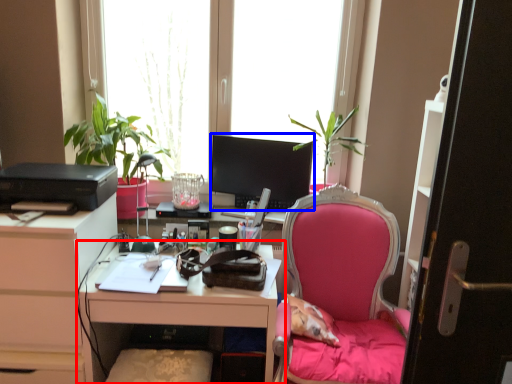
Question: Among these objects, which one is nearest to the camera, desk (highlighted by a red box) or television (highlighted by a blue box)?

Choices:
 (A) desk
 (B) television

Answer: (A)